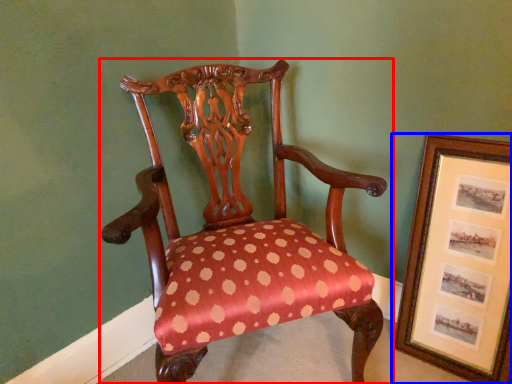
Question: Which point is closer to the camera, chair (highlighted by a red box) or picture frame (highlighted by a blue box)?

Choices:
 (A) chair
 (B) picture frame

Answer: (A)